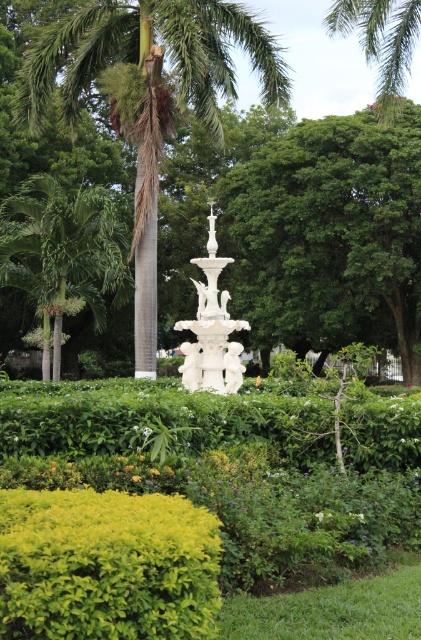
Question: Is the position of green leafy palm tree at center less distant than that of green leafy palm at left?

Choices:
 (A) no
 (B) yes

Answer: (B)

Question: Among these objects, which one is farthest from the camera?

Choices:
 (A) green leafy palm at upper right
 (B) green leafy palm at left
 (C) white marble fountain at center

Answer: (B)

Question: Estimate the real-world distances between objects in this image. Which object is closer to the green leafy palm tree at center?

Choices:
 (A) white marble fountain at center
 (B) green leafy palm at upper right
 (C) green leafy palm at left

Answer: (C)

Question: Does green leafy palm at upper right have a smaller size compared to white marble fountain at center?

Choices:
 (A) no
 (B) yes

Answer: (A)

Question: Does green leafy palm tree at center appear on the right side of green leafy palm at left?

Choices:
 (A) yes
 (B) no

Answer: (A)

Question: Among these objects, which one is farthest from the camera?

Choices:
 (A) green leafy palm at left
 (B) green leafy palm tree at center
 (C) green leafy palm at upper right
 (D) white marble fountain at center

Answer: (A)